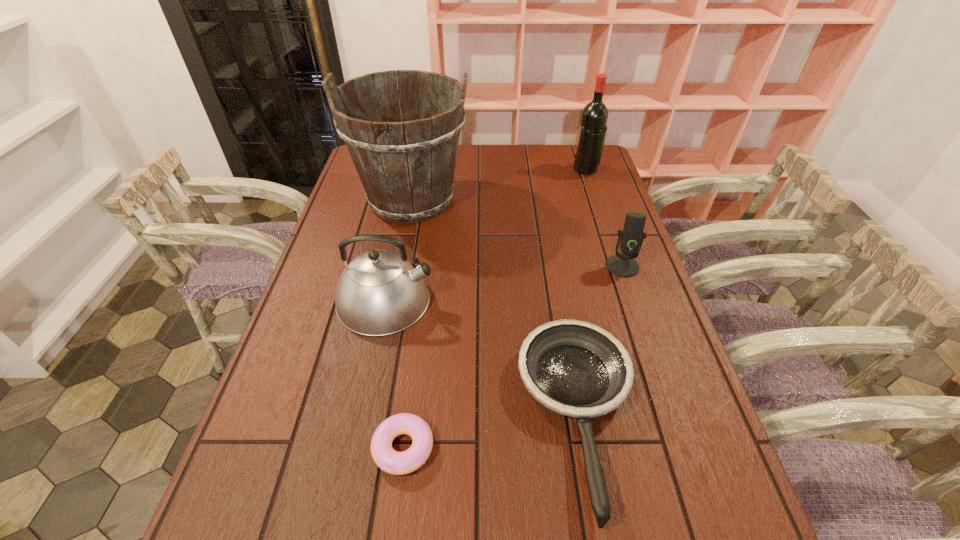
At what (x,y) coordinates should I click in order to perform the action: click on empty space between the doughnut and the kettle. Please return your answer as a coordinate pair (x, y). The width and height of the screenshot is (960, 540). Looking at the image, I should click on (395, 374).

This screenshot has width=960, height=540. Identify the location of free space that is in between the third shortest object and the kettle. (504, 284).

Locate an element on the screen. The height and width of the screenshot is (540, 960). the second closest object relative to the bucket is located at coordinates (594, 116).

Choose which object is the fifth nearest neighbor to the fourth shortest object. Please provide its 2D coordinates. Your answer should be formatted as a tuple, i.e. [(x, y)], where the tuple contains the x and y coordinates of a point satisfying the conditions above.

[(594, 116)]

Locate an element on the screen. The image size is (960, 540). vacant space that satisfies the following two spatial constraints: 1. on the front side of the microphone; 2. on the left side of the wine bottle is located at coordinates (617, 266).